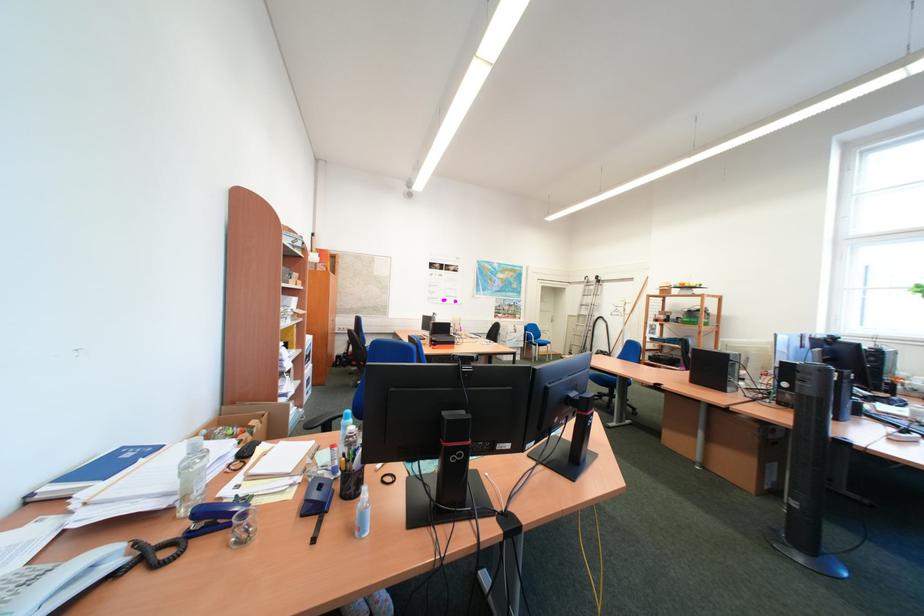
Where is `blue stapler`? Image resolution: width=924 pixels, height=616 pixels. blue stapler is located at coordinates (214, 512).